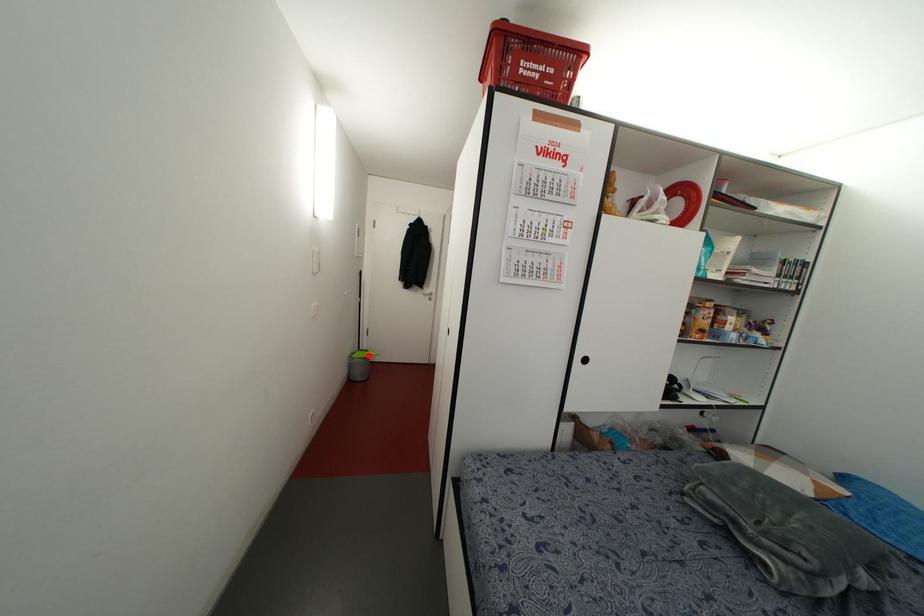
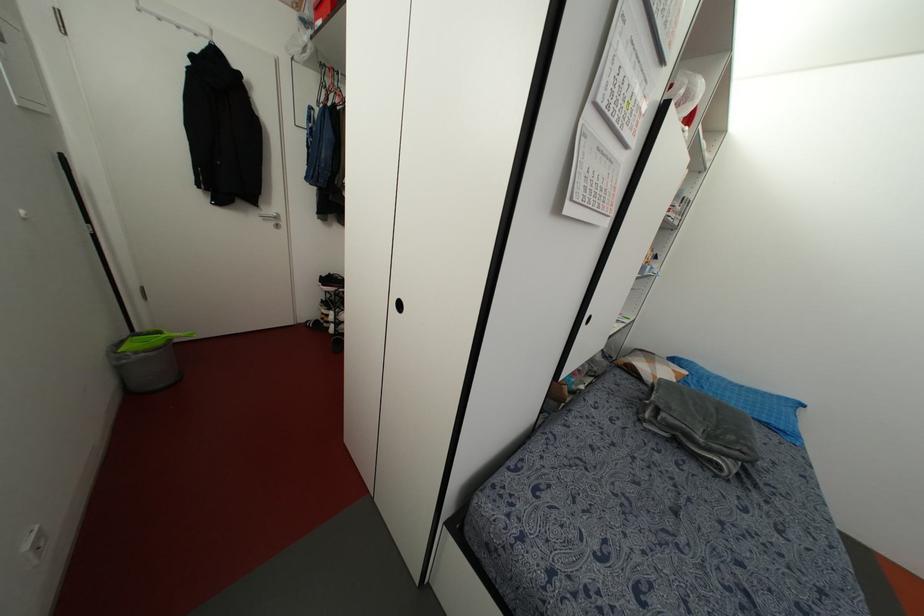
Where in the second image is the point corresponding to the highlighted location from the first image?

(168, 339)